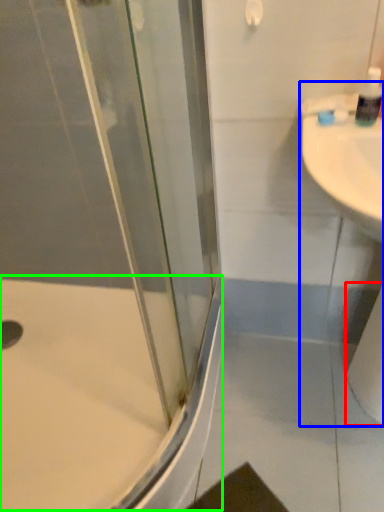
Question: Estimate the real-world distances between objects in this image. Which object is farther from toilet paper (highlighted by a red box), sink (highlighted by a blue box) or bath (highlighted by a green box)?

Choices:
 (A) sink
 (B) bath

Answer: (B)